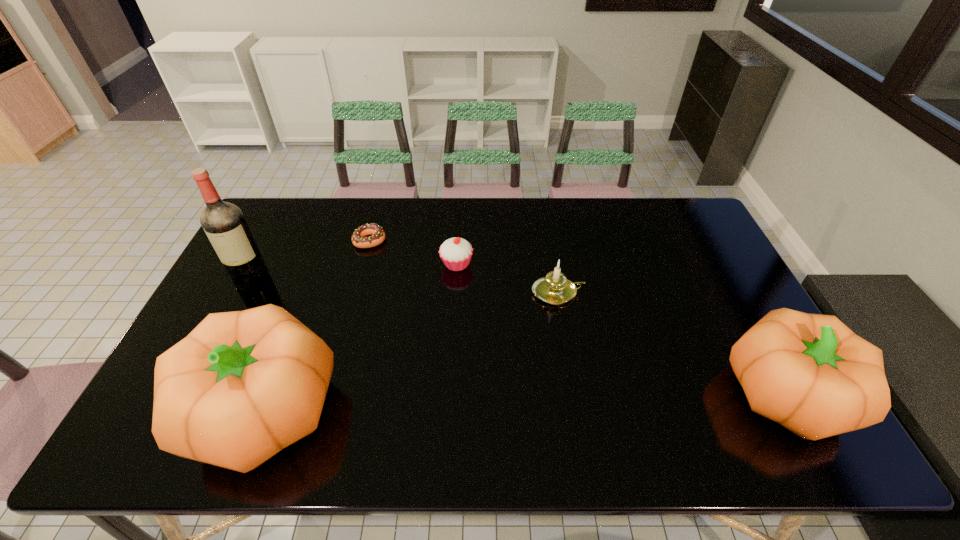
Please mark a free spot for a new pumpkin to balance the arrangement. Please provide its 2D coordinates. Your answer should be formatted as a tuple, i.e. [(x, y)], where the tuple contains the x and y coordinates of a point satisfying the conditions above.

[(529, 401)]